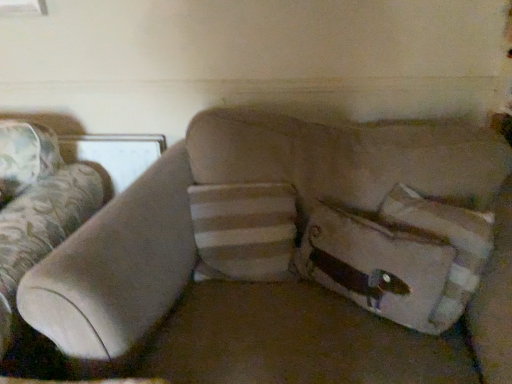
Image resolution: width=512 pixels, height=384 pixels. What do you see at coordinates (293, 257) in the screenshot?
I see `suede beige couch at center` at bounding box center [293, 257].

You are a GUI agent. You are given a task and a screenshot of the screen. Output one action in this format:
    pyautogui.click(x=<x>, y=<y>)
    Task: Click on the suede beige couch at center
    
    Given the screenshot: What is the action you would take?
    tap(293, 257)

The height and width of the screenshot is (384, 512). I want to click on white striped pillow at right, so click(x=448, y=244).

Describe the element at coordinates (448, 244) in the screenshot. I see `white striped pillow at right` at that location.

What is the approximate height of white striped pillow at right?

15.42 inches.

Where is `suede beige couch at center`? This screenshot has width=512, height=384. suede beige couch at center is located at coordinates pos(293,257).

Based on their positions, is suede beige couch at center located to the left or right of white striped pillow at right?

Clearly, suede beige couch at center is on the left of white striped pillow at right in the image.

From the picture: Considering the positions of objects suede beige couch at center and white striped pillow at right in the image provided, who is in front, suede beige couch at center or white striped pillow at right?

suede beige couch at center is closer to the camera.

Is point (411, 161) closer or farther from the camera than point (434, 221)?

Point (411, 161).

Based on the photo, from the image's perspective, who appears lower, suede beige couch at center or white striped pillow at right?

suede beige couch at center, from the image's perspective.

From a real-world perspective, is suede beige couch at center under white striped pillow at right?

Yes.

Between suede beige couch at center and white striped pillow at right, which one has larger width?

suede beige couch at center is wider.

Does suede beige couch at center have a greater height compared to white striped pillow at right?

Yes, suede beige couch at center is taller than white striped pillow at right.

Considering the relative sizes of suede beige couch at center and white striped pillow at right in the image provided, is suede beige couch at center bigger than white striped pillow at right?

Yes.

Is suede beige couch at center inside or outside of white striped pillow at right?

suede beige couch at center exists outside the volume of white striped pillow at right.

Is suede beige couch at center far away from white striped pillow at right?

suede beige couch at center is actually quite close to white striped pillow at right.

Is suede beige couch at center positioned with its back to white striped pillow at right?

That's right, suede beige couch at center is facing away from white striped pillow at right.

How different are the orientations of suede beige couch at center and white striped pillow at right in degrees?

147 degrees.

The width and height of the screenshot is (512, 384). In order to click on pillow that is on the right side of suede beige couch at center in this screenshot , I will do `click(448, 244)`.

Does white striped pillow at right appear on the left side of suede beige couch at center?

Incorrect, white striped pillow at right is not on the left side of suede beige couch at center.

From the picture: Which object is further away from the camera taking this photo, white striped pillow at right or suede beige couch at center?

white striped pillow at right is further from the camera.

Considering the points (381, 205) and (510, 245), which point is behind, point (381, 205) or point (510, 245)?

Point (381, 205)

From the image's perspective, does white striped pillow at right appear lower than suede beige couch at center?

Incorrect, from the image's perspective, white striped pillow at right is higher than suede beige couch at center.

From a real-world perspective, relative to suede beige couch at center, is white striped pillow at right vertically above or below?

From a real-world perspective, white striped pillow at right is physically above suede beige couch at center.

Looking at their sizes, would you say white striped pillow at right is wider or thinner than suede beige couch at center?

In the image, white striped pillow at right appears to be more narrow than suede beige couch at center.

Looking at this image, can you confirm if white striped pillow at right is taller than suede beige couch at center?

In fact, white striped pillow at right may be shorter than suede beige couch at center.

Who is bigger, white striped pillow at right or suede beige couch at center?

suede beige couch at center.

Is suede beige couch at center surrounded by white striped pillow at right?

No, suede beige couch at center is not surrounded by white striped pillow at right.

Are white striped pillow at right and suede beige couch at center beside each other?

white striped pillow at right is not next to suede beige couch at center, and they're not touching.

Is white striped pillow at right facing towards suede beige couch at center?

Yes, white striped pillow at right is facing suede beige couch at center.

Can you tell me how much white striped pillow at right and suede beige couch at center differ in facing direction?

They differ by 147 degrees in their facing directions.

Locate an element on the screen. This screenshot has height=384, width=512. couch located in front of the white striped pillow at right is located at coordinates (293, 257).

Image resolution: width=512 pixels, height=384 pixels. Identify the location of pillow behind the suede beige couch at center. (448, 244).

You are a GUI agent. You are given a task and a screenshot of the screen. Output one action in this format:
    pyautogui.click(x=<x>, y=<y>)
    Task: Click on the pillow on the right of suede beige couch at center
    The width and height of the screenshot is (512, 384).
    Given the screenshot: What is the action you would take?
    pyautogui.click(x=448, y=244)